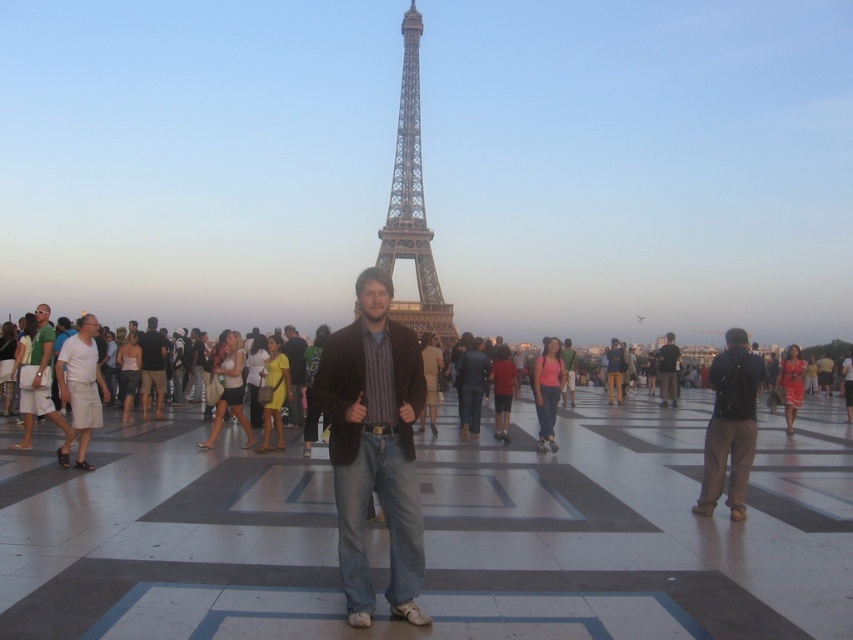
Between dark blue jeans at center and dark brown leather jacket at right, which one has more height?

dark blue jeans at center is taller.

Is dark blue jeans at center positioned behind dark brown leather jacket at right?

No, it is not.

Is point (735, 353) positioned after point (666, 369)?

No, it is in front of (666, 369).

You are a GUI agent. You are given a task and a screenshot of the screen. Output one action in this format:
    pyautogui.click(x=<x>, y=<y>)
    Task: Click on the dark blue jeans at center
    The width and height of the screenshot is (853, 640).
    Given the screenshot: What is the action you would take?
    tap(730, 424)

Is dark blue jeans at center behind green cotton shirt at left?

No, it is in front of green cotton shirt at left.

Is point (735, 429) positioned before point (41, 380)?

No.

Identify the location of dark blue jeans at center. (730, 424).

Is point (404, 163) farther from viewer compared to point (154, 353)?

Yes, it is behind point (154, 353).

Locate an element on the screen. metallic gold eiffel tower at center is located at coordinates click(x=412, y=202).

Between point (413, 17) and point (165, 385), which one is positioned in front?

Point (165, 385)

The width and height of the screenshot is (853, 640). I want to click on metallic gold eiffel tower at center, so click(x=412, y=202).